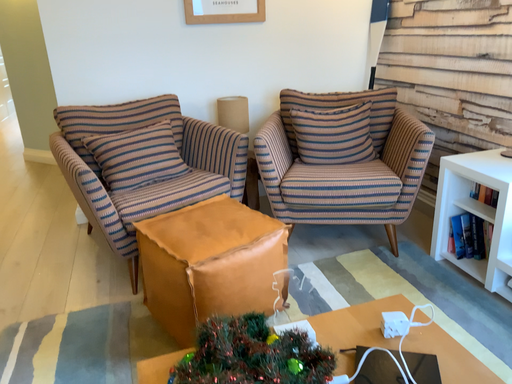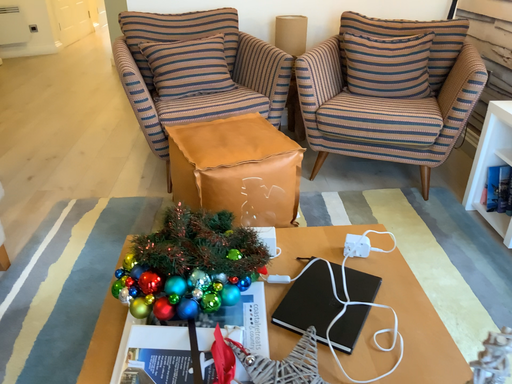
Question: Which way did the camera rotate in the video?

Choices:
 (A) rotated left
 (B) rotated right

Answer: (A)